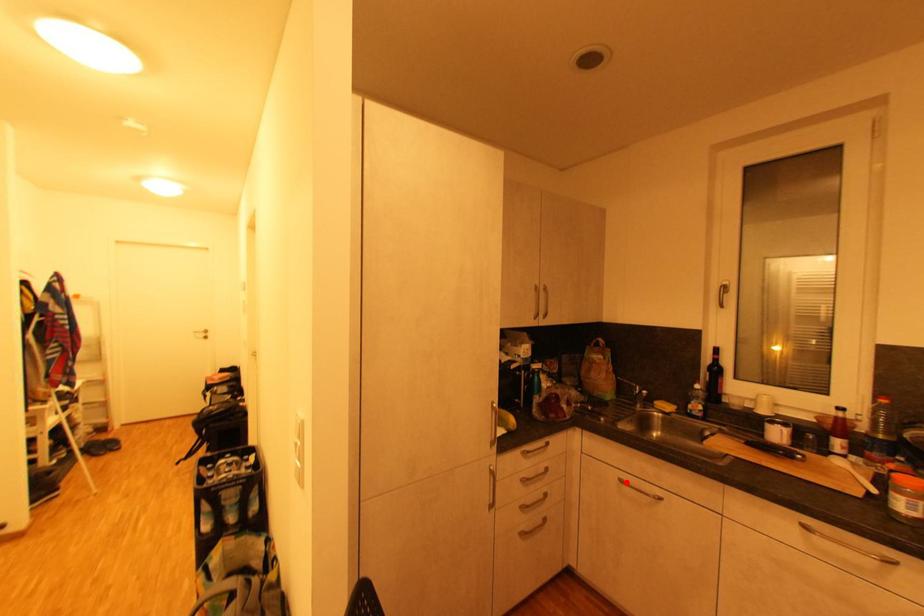
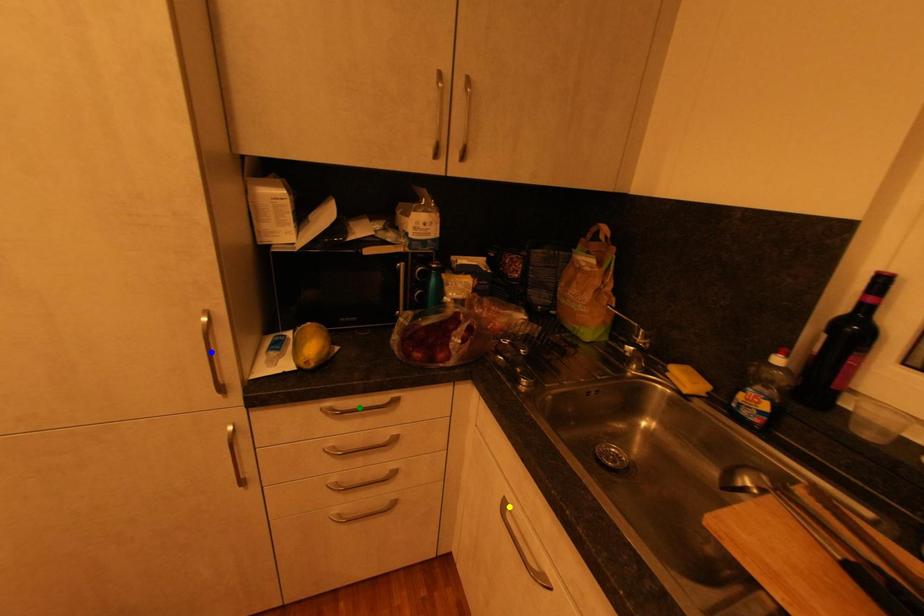
Question: I am providing you with two images of the same scene from different viewpoints. A red point is marked on the first image. You are given multiple points on the second image. Which spot in image 2 lines up with the point in image 1?

Choices:
 (A) blue point
 (B) yellow point
 (C) green point

Answer: (B)